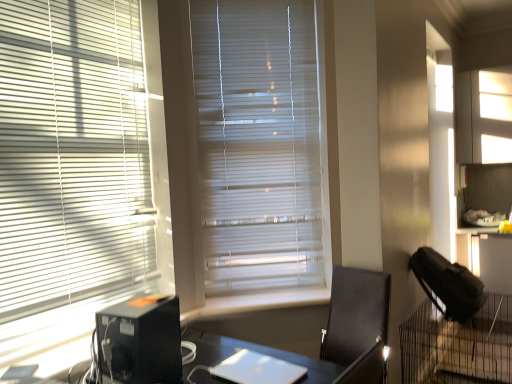
Question: Should I look upward or downward to see white matte blinds at left, the 1th window blind when ordered from left to right?

Choices:
 (A) down
 (B) up

Answer: (B)

Question: Does white matte blinds at center, the second window blind positioned from the front, have a lesser height compared to white smooth window sill at center?

Choices:
 (A) no
 (B) yes

Answer: (A)

Question: From the image's perspective, would you say white matte blinds at center, which ranks as the 1th window blind in right-to-left order, is shown under white smooth window sill at center?

Choices:
 (A) no
 (B) yes

Answer: (A)

Question: Can you confirm if white matte blinds at center, which is the first window blind in back-to-front order, is wider than white smooth window sill at center?

Choices:
 (A) yes
 (B) no

Answer: (B)

Question: Can you confirm if white matte blinds at center, which ranks as the 1th window blind in right-to-left order, is smaller than white smooth window sill at center?

Choices:
 (A) no
 (B) yes

Answer: (A)

Question: Can you see white matte blinds at center, which is the first window blind in back-to-front order, touching white smooth window sill at center?

Choices:
 (A) yes
 (B) no

Answer: (B)

Question: From the image's perspective, is white matte blinds at center, which is the first window blind in back-to-front order, above white smooth window sill at center?

Choices:
 (A) yes
 (B) no

Answer: (A)

Question: Considering the relative sizes of black mesh cage at lower right and white matte blinds at center, which is the first window blind in back-to-front order, in the image provided, is black mesh cage at lower right smaller than white matte blinds at center, which is the first window blind in back-to-front order,?

Choices:
 (A) yes
 (B) no

Answer: (B)

Question: Considering the relative sizes of black mesh cage at lower right and white matte blinds at center, which is the first window blind in back-to-front order, in the image provided, is black mesh cage at lower right thinner than white matte blinds at center, which is the first window blind in back-to-front order,?

Choices:
 (A) no
 (B) yes

Answer: (A)

Question: Is black mesh cage at lower right further to the viewer compared to white matte blinds at center, the second window blind positioned from the front?

Choices:
 (A) no
 (B) yes

Answer: (A)

Question: From the image's perspective, is black mesh cage at lower right above white matte blinds at center, which ranks as the 1th window blind in right-to-left order?

Choices:
 (A) yes
 (B) no

Answer: (B)

Question: Is black mesh cage at lower right closer to the viewer compared to white matte blinds at center, which ranks as the 1th window blind in right-to-left order?

Choices:
 (A) no
 (B) yes

Answer: (B)

Question: Can you confirm if black mesh cage at lower right is wider than white matte blinds at center, the second window blind positioned from the front?

Choices:
 (A) no
 (B) yes

Answer: (B)

Question: Does black plastic computer tower at lower left have a lesser height compared to white matte blinds at left, marked as the 2th window blind in a right-to-left arrangement?

Choices:
 (A) yes
 (B) no

Answer: (A)